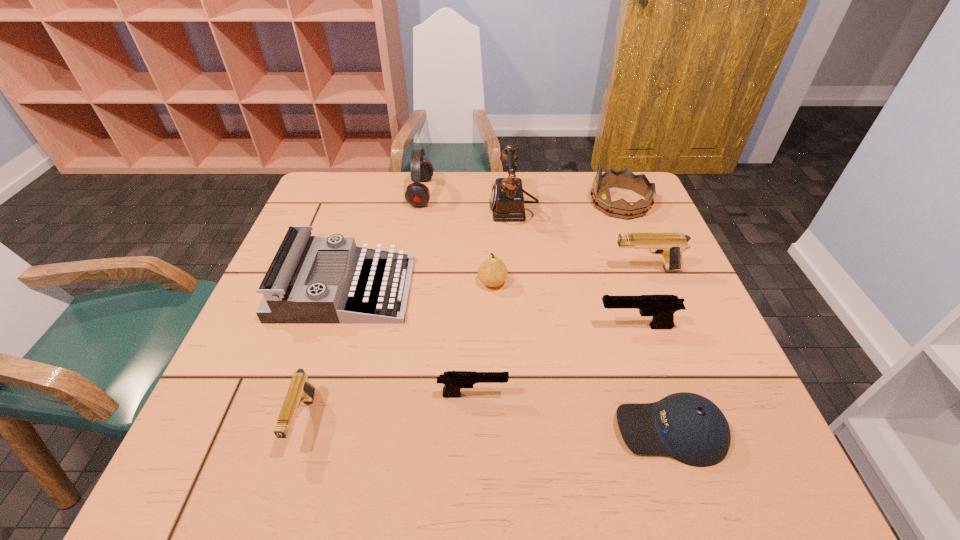
The image size is (960, 540). I want to click on free space that satisfies the following two spatial constraints: 1. on the ear cups of the earphone; 2. on the back side of the pear, so click(406, 282).

This screenshot has height=540, width=960. What are the coordinates of `vacant space that satisfies the following two spatial constraints: 1. at the front of the tiara with jewels; 2. at the barrel of the nearer tan pistol` in the screenshot? It's located at [707, 420].